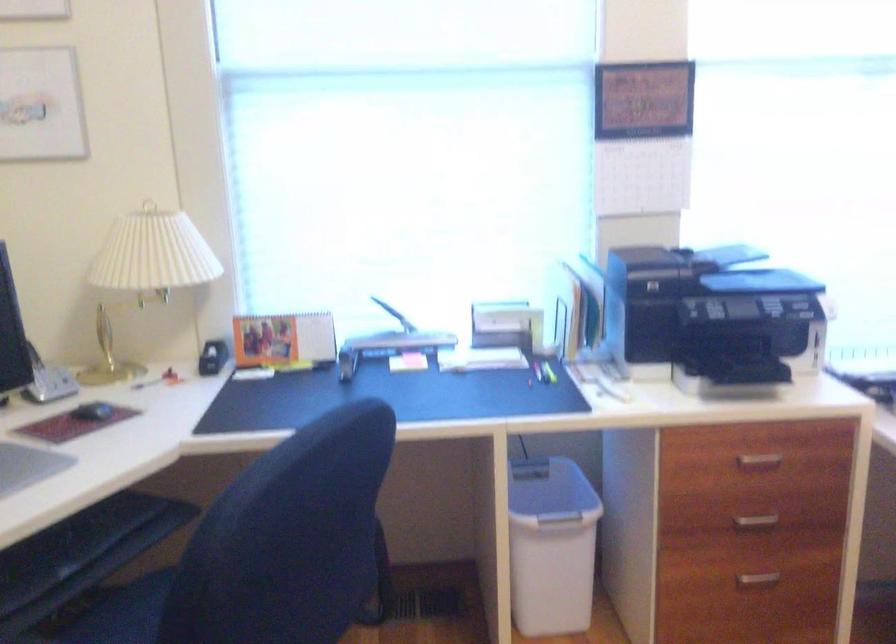
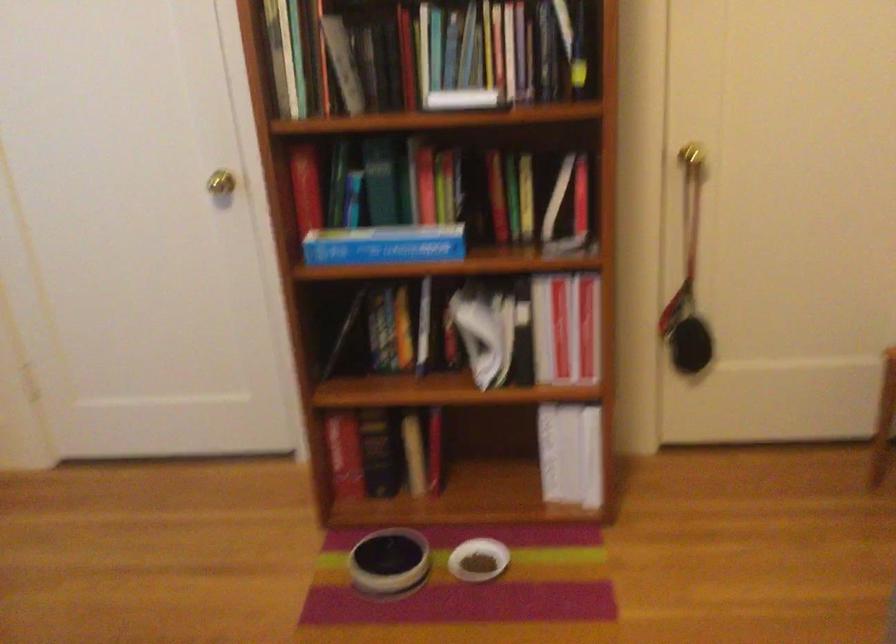
How did the camera likely rotate?

The camera rotated toward right-down.